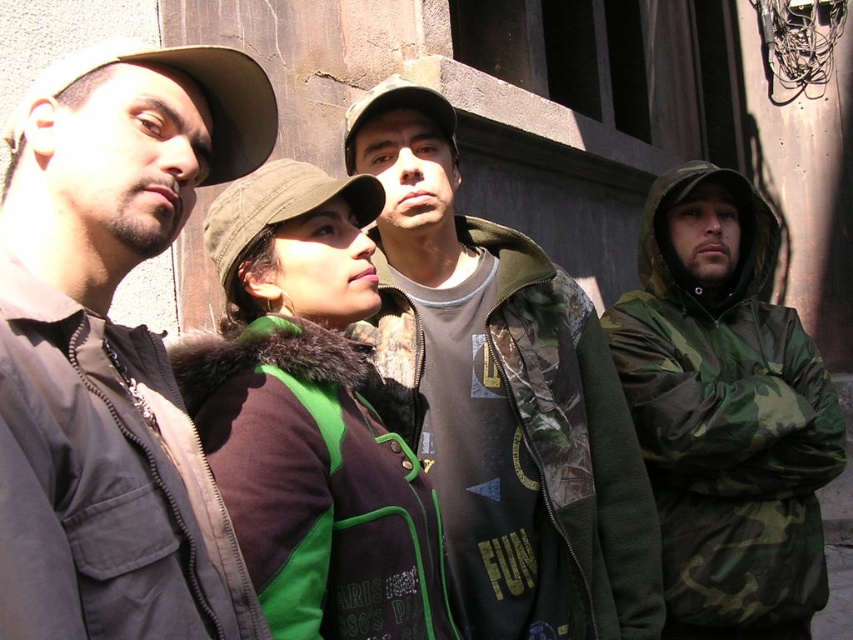
Question: Estimate the real-world distances between objects in this image. Which object is farther from the matte brown jacket at left?

Choices:
 (A) green fabric baseball cap at center
 (B) camo jacket at center

Answer: (B)

Question: Can you confirm if matte brown jacket at left is positioned to the left of green fuzzy jacket at center?

Choices:
 (A) no
 (B) yes

Answer: (A)

Question: Which point is closer to the camera?

Choices:
 (A) (453, 570)
 (B) (206, 353)

Answer: (B)

Question: Can you confirm if green fuzzy jacket at center is smaller than green fabric baseball cap at center?

Choices:
 (A) no
 (B) yes

Answer: (B)

Question: Which point is closer to the camera?

Choices:
 (A) (314, 196)
 (B) (312, 401)
 (C) (241, 68)

Answer: (C)

Question: Is camo jacket at center wider than green fabric baseball cap at center?

Choices:
 (A) no
 (B) yes

Answer: (B)